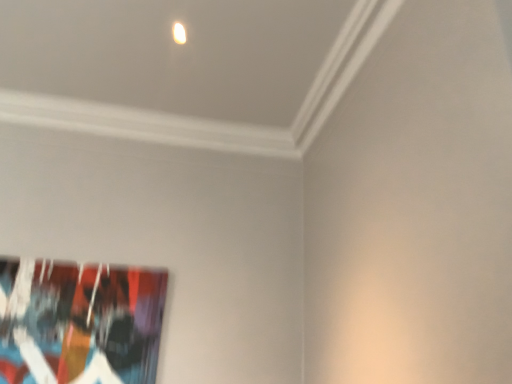
Question: Considering their positions, is abstract painting at lower left located in front of or behind matte white light at upper center?

Choices:
 (A) behind
 (B) front

Answer: (A)

Question: In the image, is abstract painting at lower left on the left side or the right side of matte white light at upper center?

Choices:
 (A) left
 (B) right

Answer: (A)

Question: In terms of height, does abstract painting at lower left look taller or shorter compared to matte white light at upper center?

Choices:
 (A) tall
 (B) short

Answer: (A)

Question: From a real-world perspective, is matte white light at upper center physically located above or below abstract painting at lower left?

Choices:
 (A) below
 (B) above

Answer: (B)

Question: In terms of width, does matte white light at upper center look wider or thinner when compared to abstract painting at lower left?

Choices:
 (A) thin
 (B) wide

Answer: (B)

Question: Is matte white light at upper center inside or outside of abstract painting at lower left?

Choices:
 (A) inside
 (B) outside

Answer: (B)

Question: From the image's perspective, is matte white light at upper center above or below abstract painting at lower left?

Choices:
 (A) above
 (B) below

Answer: (A)